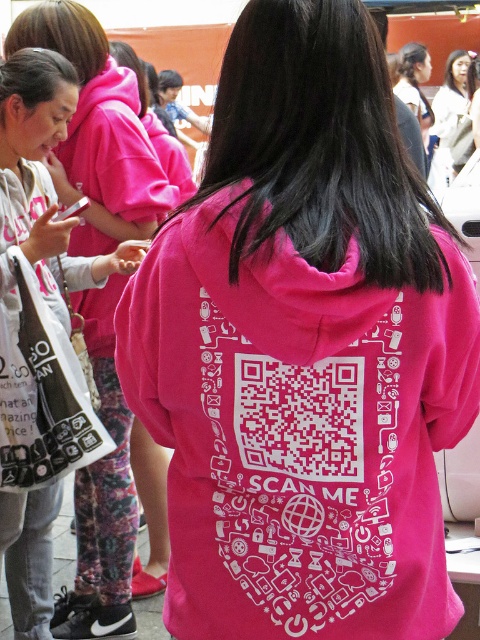
Does pink matte hoodie at upper center appear on the left side of white cotton blouse at upper center?

Yes, pink matte hoodie at upper center is to the left of white cotton blouse at upper center.

Between pink matte hoodie at upper center and white cotton blouse at upper center, which one is positioned higher?

Positioned higher is white cotton blouse at upper center.

Is point (4, 99) more distant than point (450, 72)?

No.

The image size is (480, 640). Identify the location of pink matte hoodie at upper center. (44, 177).